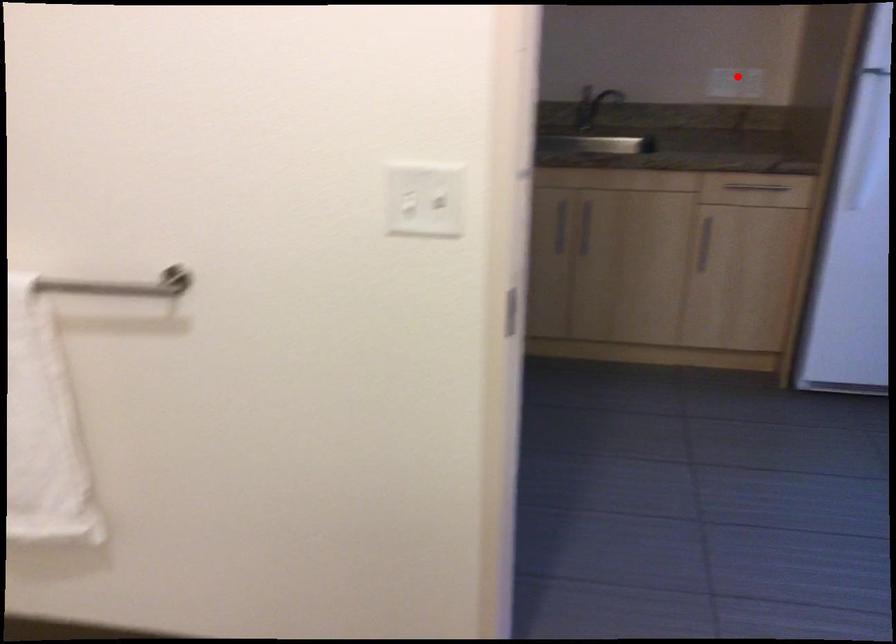
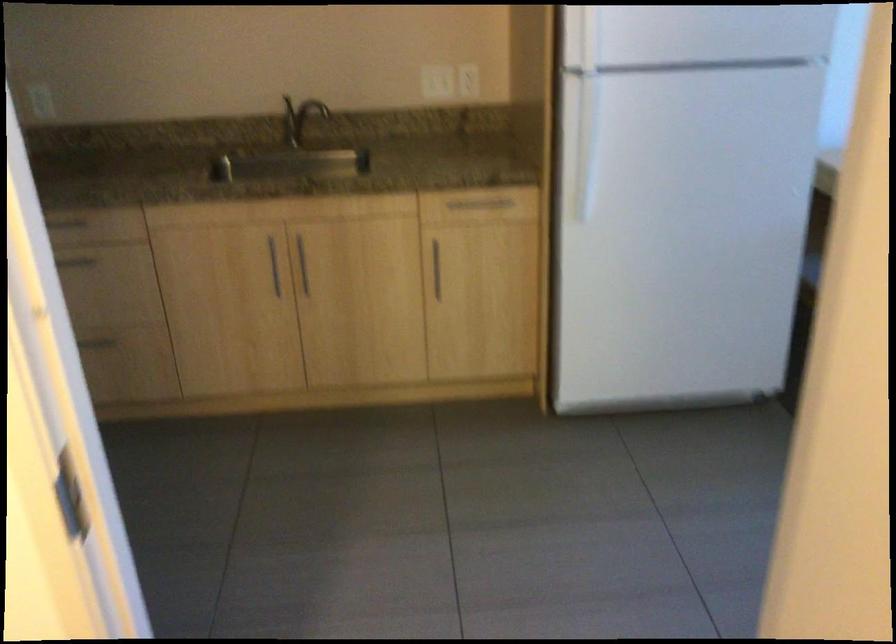
Locate, in the second image, the point that corresponds to the highlighted location in the first image.

(468, 80)